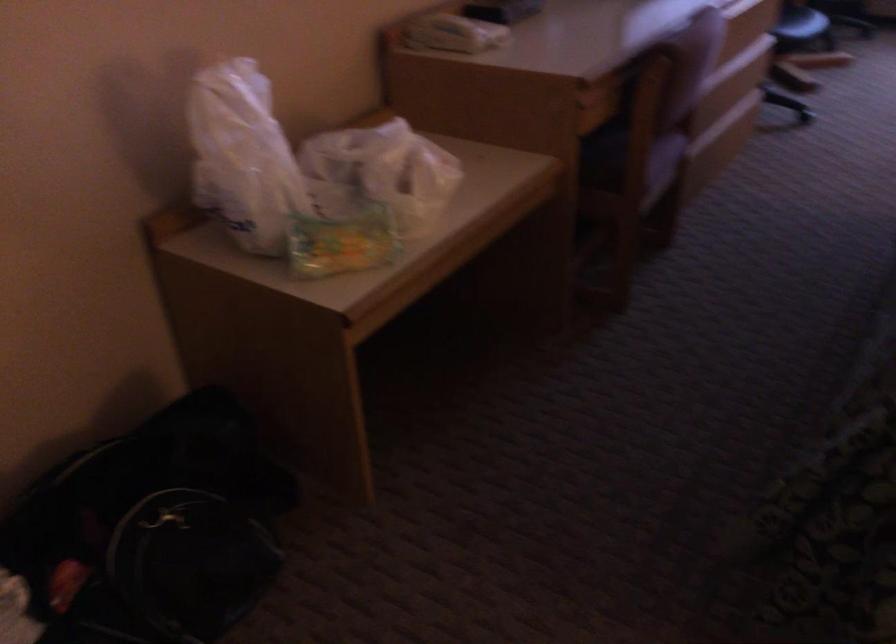
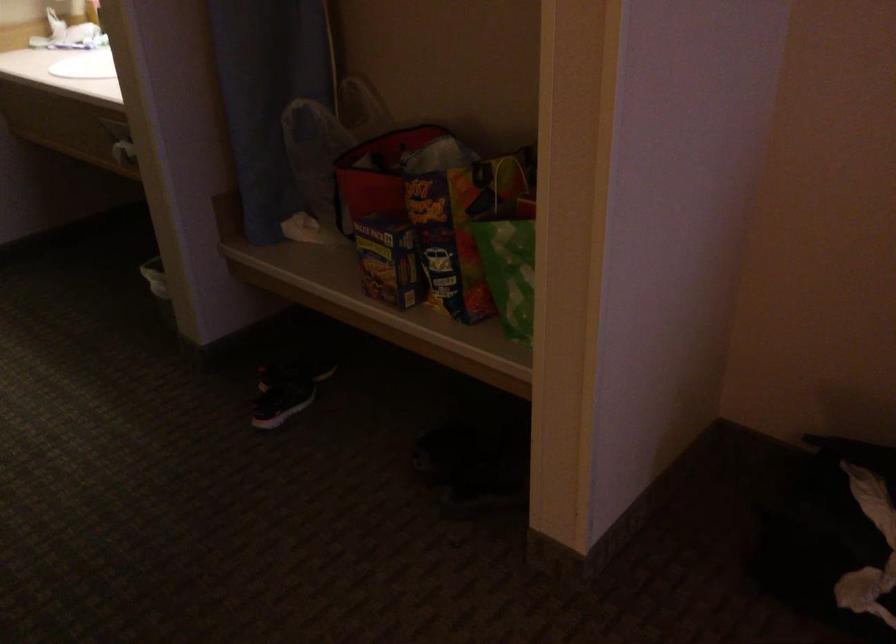
First-person continuous shooting, in which direction is the camera rotating?

The camera rotated toward left-down.